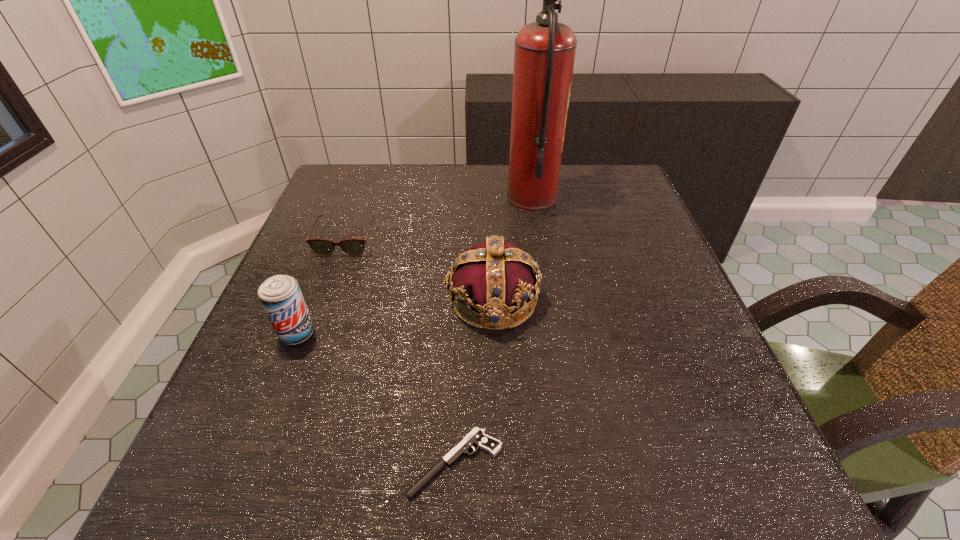
Where is `vacant space that satisfies the following two spatial constraints: 1. on the back side of the third shortest object; 2. on the left side of the crown`? Image resolution: width=960 pixels, height=540 pixels. vacant space that satisfies the following two spatial constraints: 1. on the back side of the third shortest object; 2. on the left side of the crown is located at coordinates (310, 300).

Identify the location of free location that satisfies the following two spatial constraints: 1. at the nozzle of the fire extinguisher; 2. at the front view of the second farthest object. (539, 240).

This screenshot has height=540, width=960. I want to click on free space that satisfies the following two spatial constraints: 1. at the nozzle of the farthest object; 2. at the front view of the spectacles, so click(539, 240).